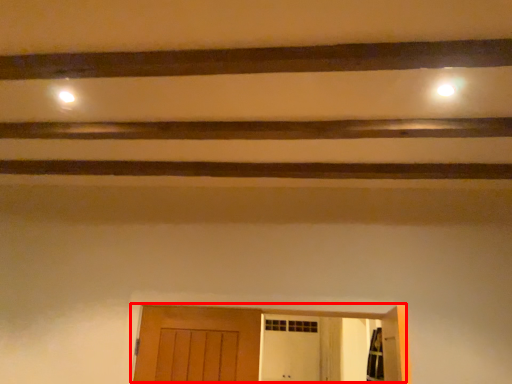
Question: From the image's perspective, where is door (annotated by the red box) located in relation to plank in the image?

Choices:
 (A) below
 (B) above

Answer: (A)